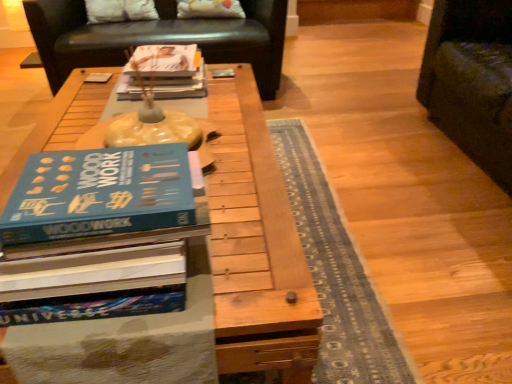
The width and height of the screenshot is (512, 384). I want to click on free spot to the right of black leather couch at upper center, so click(x=352, y=96).